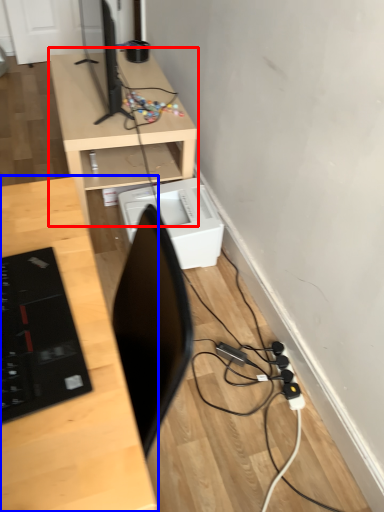
Question: Which of the following is the closest to the observer, desk (highlighted by a red box) or desk (highlighted by a blue box)?

Choices:
 (A) desk
 (B) desk

Answer: (B)